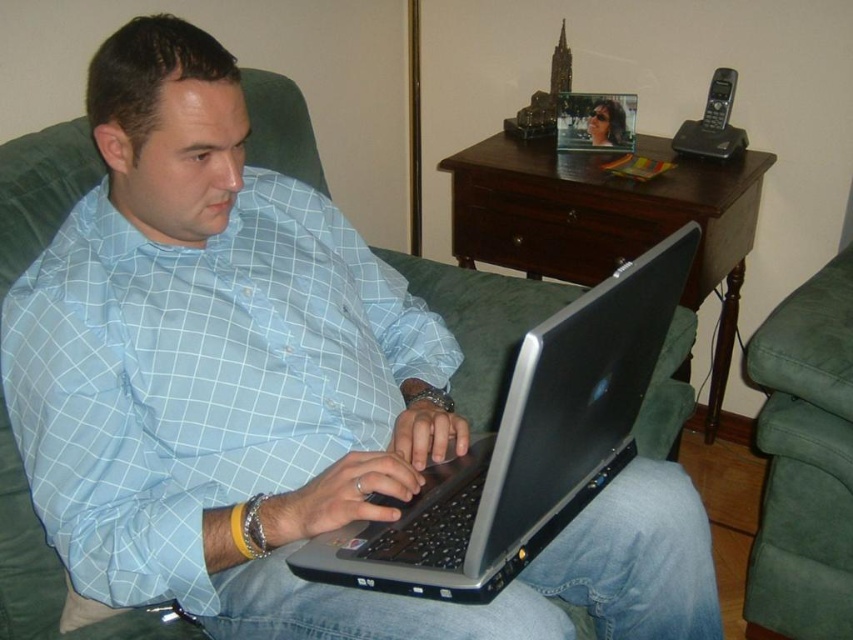
You are a photographer trying to capture a closeup of the silver metallic laptop at center without including the light blue checkered shirt at center in the frame. Given their positions, is this possible?

The light blue checkered shirt at center is to the left of the silver metallic laptop at center, so if you position your camera to the right side of the laptop and frame the shot carefully, you can exclude the shirt from the image.

You are a photographer trying to capture a closeup of the silver metallic laptop at center without the light blue checkered shirt at center blocking the view. Can you adjust your position to do so?

The silver metallic laptop at center is behind the light blue checkered shirt at center, so moving your position to the side or behind the shirt would allow you to see the laptop without obstruction.